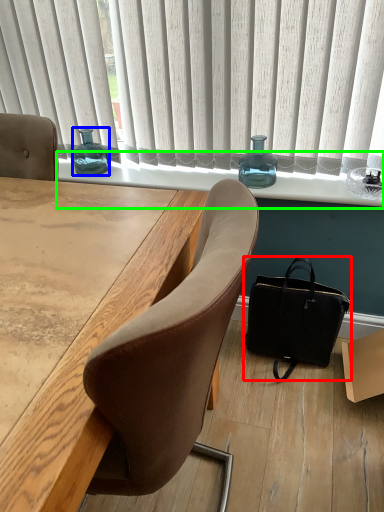
Question: Based on their relative distances, which object is farther from handbag (highlighted by a red box)? Choose from bottle (highlighted by a blue box) and window sill (highlighted by a green box).

Choices:
 (A) bottle
 (B) window sill

Answer: (A)